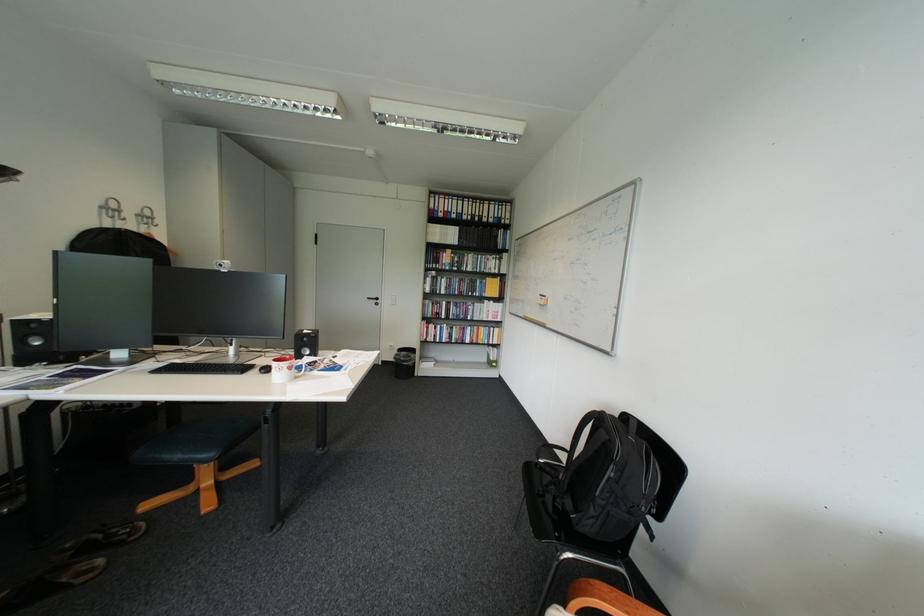
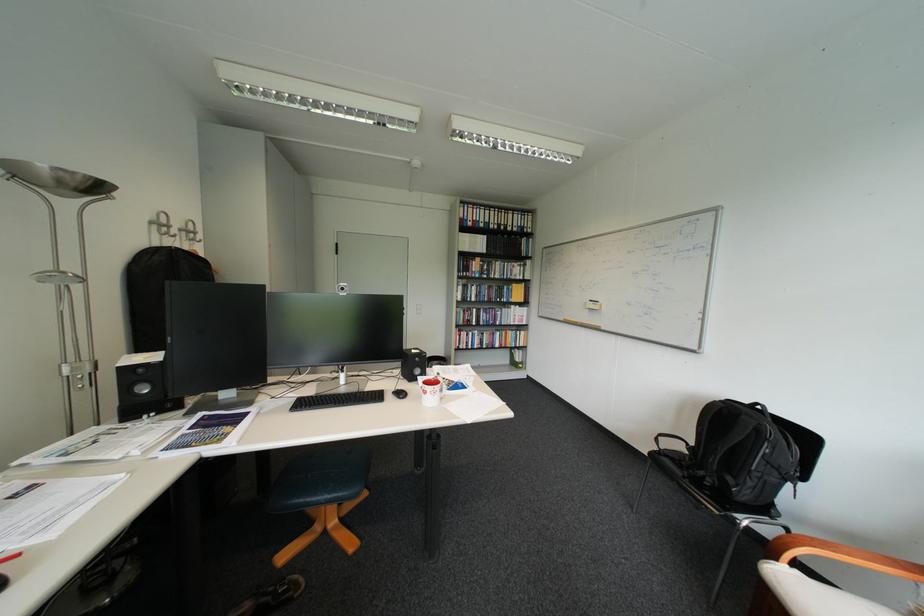
In the second image, find the point that corresponds to (x=227, y=363) in the first image.

(357, 394)